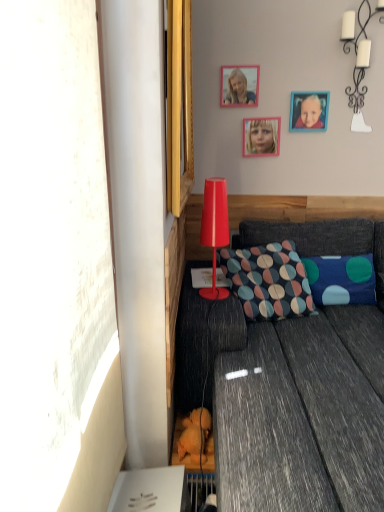
Measure the distance between point (312, 336) and camera.

Point (312, 336) and camera are 6.68 feet apart.

What is the approximate height of textured gray couch at lower right?

textured gray couch at lower right is 32.97 inches in height.

Find the location of a particular element. matte pink frame at upper center is located at coordinates [239, 90].

In order to face blue fabric pillow with colorful circles at lower right, acting as the 2th pillow starting from the left, should I rotate leftwards or rightwards?

It's best to rotate right around 18.941 degrees.

From the picture: In order to face wooden picture frame at upper right, which is the first picture frame from right to left, should I rotate leftwards or rightwards?

To face it directly, rotate right by 15.282 degrees.

Measure the distance between wooden picture frame at upper right, positioned as the second picture frame in left-to-right order, and camera.

wooden picture frame at upper right, positioned as the second picture frame in left-to-right order, and camera are 2.49 meters apart.

What do you see at coordinates (261, 136) in the screenshot? This screenshot has width=384, height=512. I see `wooden picture frame at upper center, which appears as the 1th picture frame when viewed from the left` at bounding box center [261, 136].

This screenshot has height=512, width=384. I want to click on wooden picture frame at upper center, which appears as the 1th picture frame when viewed from the left, so click(x=261, y=136).

You are a GUI agent. You are given a task and a screenshot of the screen. Output one action in this format:
    pyautogui.click(x=<x>, y=<y>)
    Task: Click on the textured gray couch at lower right
    The height and width of the screenshot is (512, 384).
    Given the screenshot: What is the action you would take?
    pyautogui.click(x=288, y=403)

Which object is positioned more to the right, matte pink frame at upper center or wooden picture frame at upper center, which ranks as the 2th picture frame in right-to-left order?

From the viewer's perspective, wooden picture frame at upper center, which ranks as the 2th picture frame in right-to-left order, appears more on the right side.

Which of these two, matte pink frame at upper center or wooden picture frame at upper center, which ranks as the 2th picture frame in right-to-left order, stands shorter?

Standing shorter between the two is wooden picture frame at upper center, which ranks as the 2th picture frame in right-to-left order.

The width and height of the screenshot is (384, 512). There is a wooden picture frame at upper center, which ranks as the 2th picture frame in right-to-left order. In order to click on person above it (from a real-world perspective) in this screenshot , I will do `click(239, 90)`.

Between white ceramic candlestick at upper right, which ranks as the second lamp in front-to-back order, and multicolored fabric pillow at center, the second pillow from the right, which one has larger width?

Wider between the two is multicolored fabric pillow at center, the second pillow from the right.

From the image's perspective, who appears lower, white ceramic candlestick at upper right, which is the first lamp from back to front, or multicolored fabric pillow at center, which is counted as the 1th pillow, starting from the left?

multicolored fabric pillow at center, which is counted as the 1th pillow, starting from the left.

Which object is positioned more to the left, white ceramic candlestick at upper right, arranged as the second lamp when viewed from the left, or multicolored fabric pillow at center, which is counted as the 1th pillow, starting from the left?

From the viewer's perspective, multicolored fabric pillow at center, which is counted as the 1th pillow, starting from the left, appears more on the left side.

Which of these two, matte pink frame at upper center or white ceramic candlestick at upper right, which is the 1th lamp from top to bottom, is smaller?

matte pink frame at upper center.

Does matte pink frame at upper center appear on the right side of white ceramic candlestick at upper right, the 2th lamp from the bottom?

No, matte pink frame at upper center is not to the right of white ceramic candlestick at upper right, the 2th lamp from the bottom.

Does matte pink frame at upper center have a greater width compared to white ceramic candlestick at upper right, which is the 1th lamp from top to bottom?

Incorrect, the width of matte pink frame at upper center does not surpass that of white ceramic candlestick at upper right, which is the 1th lamp from top to bottom.

Considering the points (243, 97) and (368, 59), which point is in front, point (243, 97) or point (368, 59)?

The point (368, 59) is in front.

Considering the positions of objects wooden picture frame at upper right, positioned as the second picture frame in left-to-right order, and wooden picture frame at upper center, which ranks as the 2th picture frame in right-to-left order, in the image provided, who is in front, wooden picture frame at upper right, positioned as the second picture frame in left-to-right order, or wooden picture frame at upper center, which ranks as the 2th picture frame in right-to-left order,?

wooden picture frame at upper right, positioned as the second picture frame in left-to-right order.

From a real-world perspective, does wooden picture frame at upper right, positioned as the second picture frame in left-to-right order, stand above wooden picture frame at upper center, which appears as the 1th picture frame when viewed from the left?

Yes, from a real-world perspective, wooden picture frame at upper right, positioned as the second picture frame in left-to-right order, is above wooden picture frame at upper center, which appears as the 1th picture frame when viewed from the left.

Is wooden picture frame at upper right, which is the first picture frame from right to left, not within wooden picture frame at upper center, which ranks as the 2th picture frame in right-to-left order?

Yes, wooden picture frame at upper right, which is the first picture frame from right to left, is located beyond the bounds of wooden picture frame at upper center, which ranks as the 2th picture frame in right-to-left order.

How different are the orientations of wooden picture frame at upper right, which is the first picture frame from right to left, and wooden picture frame at upper center, which appears as the 1th picture frame when viewed from the left, in degrees?

0.00373 degrees.

Can you tell me how much white ceramic candlestick at upper right, the 2th lamp from the bottom, and textured gray couch at lower right differ in facing direction?

The angle between the facing direction of white ceramic candlestick at upper right, the 2th lamp from the bottom, and the facing direction of textured gray couch at lower right is 0.558 degrees.

The image size is (384, 512). Find the location of `studio couch in front of the white ceramic candlestick at upper right, which is the first lamp in right-to-left order`. studio couch in front of the white ceramic candlestick at upper right, which is the first lamp in right-to-left order is located at coordinates (288, 403).

Which point is more forward, (364, 91) or (178, 400)?

Positioned in front is point (178, 400).

From a real-world perspective, is white ceramic candlestick at upper right, which is the 1th lamp from top to bottom, below textured gray couch at lower right?

No, from a real-world perspective, white ceramic candlestick at upper right, which is the 1th lamp from top to bottom, is not under textured gray couch at lower right.

Is white ceramic candlestick at upper right, which ranks as the second lamp in front-to-back order, facing away from blue fabric pillow with colorful circles at lower right, acting as the 2th pillow starting from the left?

No, white ceramic candlestick at upper right, which ranks as the second lamp in front-to-back order,'s orientation is not away from blue fabric pillow with colorful circles at lower right, acting as the 2th pillow starting from the left.

From the image's perspective, starting from the white ceramic candlestick at upper right, which is the first lamp from back to front, which pillow is the 2nd one below? Please provide its 2D coordinates.

[(341, 279)]

From the picture: Is white ceramic candlestick at upper right, arranged as the second lamp when viewed from the left, bigger or smaller than blue fabric pillow with colorful circles at lower right, which is counted as the 1th pillow, starting from the right?

white ceramic candlestick at upper right, arranged as the second lamp when viewed from the left, is smaller than blue fabric pillow with colorful circles at lower right, which is counted as the 1th pillow, starting from the right.

Is white ceramic candlestick at upper right, arranged as the second lamp when viewed from the left, shorter than blue fabric pillow with colorful circles at lower right, acting as the 2th pillow starting from the left?

Incorrect, the height of white ceramic candlestick at upper right, arranged as the second lamp when viewed from the left, does not fall short of that of blue fabric pillow with colorful circles at lower right, acting as the 2th pillow starting from the left.

Is the position of matte plastic lamp at center, positioned as the second lamp in top-to-bottom order, less distant than that of textured gray couch at lower right?

No.

Which object is positioned more to the right, matte plastic lamp at center, positioned as the 2th lamp in back-to-front order, or textured gray couch at lower right?

textured gray couch at lower right.

Identify the location of studio couch below the matte plastic lamp at center, which ranks as the first lamp in bottom-to-top order (from a real-world perspective). (288, 403).

From the image's perspective, is matte plastic lamp at center, which appears as the second lamp when viewed from the right, above textured gray couch at lower right?

Yes.

Where is `the 2nd picture frame behind the matte pink frame at upper center`? The height and width of the screenshot is (512, 384). the 2nd picture frame behind the matte pink frame at upper center is located at coordinates (261, 136).

At what (x,y) coordinates should I click in order to perform the action: click on pillow that is the 2nd object to the left of the white ceramic candlestick at upper right, which is the first lamp in right-to-left order, starting at the anchor. Please return your answer as a coordinate pair (x, y). The height and width of the screenshot is (512, 384). Looking at the image, I should click on (268, 281).

Looking at the image, which one is located further to white ceramic candlestick at upper right, arranged as the second lamp when viewed from the left, textured gray couch at lower right or transparent glass window at left?

Among the two, transparent glass window at left is located further to white ceramic candlestick at upper right, arranged as the second lamp when viewed from the left.

From the image, which object appears to be nearer to wooden picture frame at upper center, which appears as the 1th picture frame when viewed from the left, matte pink frame at upper center or matte plastic lamp at center, marked as the first lamp in a left-to-right arrangement?

Among the two, matte pink frame at upper center is located nearer to wooden picture frame at upper center, which appears as the 1th picture frame when viewed from the left.

Looking at this image, considering their positions, is matte plastic lamp at center, the 1th lamp positioned from the front, positioned further to matte pink frame at upper center than wooden picture frame at upper right, which is the first picture frame from right to left?

Based on the image, matte plastic lamp at center, the 1th lamp positioned from the front, appears to be further to matte pink frame at upper center.

Considering their positions, is wooden picture frame at upper right, positioned as the second picture frame in left-to-right order, positioned closer to white ceramic candlestick at upper right, which is the 1th lamp from top to bottom, than matte plastic lamp at center, positioned as the 2th lamp in back-to-front order?

Based on the image, wooden picture frame at upper right, positioned as the second picture frame in left-to-right order, appears to be nearer to white ceramic candlestick at upper right, which is the 1th lamp from top to bottom.

Looking at the image, which one is located further to textured gray couch at lower right, blue fabric pillow with colorful circles at lower right, which is counted as the 1th pillow, starting from the right, or wooden picture frame at upper center, which appears as the 1th picture frame when viewed from the left?

wooden picture frame at upper center, which appears as the 1th picture frame when viewed from the left.

Looking at the image, which one is located further to matte plastic lamp at center, which ranks as the first lamp in bottom-to-top order, matte pink frame at upper center or wooden picture frame at upper right, positioned as the second picture frame in left-to-right order?

The object further to matte plastic lamp at center, which ranks as the first lamp in bottom-to-top order, is wooden picture frame at upper right, positioned as the second picture frame in left-to-right order.

Which object lies further to the anchor point wooden picture frame at upper center, which appears as the 1th picture frame when viewed from the left, matte plastic lamp at center, positioned as the second lamp in top-to-bottom order, or transparent glass window at left?

The object further to wooden picture frame at upper center, which appears as the 1th picture frame when viewed from the left, is transparent glass window at left.

Based on their spatial positions, is wooden picture frame at upper center, which ranks as the 2th picture frame in right-to-left order, or transparent glass window at left further from matte pink frame at upper center?

Among the two, transparent glass window at left is located further to matte pink frame at upper center.

Locate an element on the screen. lamp between matte pink frame at upper center and multicolored fabric pillow at center, which is counted as the 1th pillow, starting from the left, from top to bottom is located at coordinates (214, 230).

You are a GUI agent. You are given a task and a screenshot of the screen. Output one action in this format:
    pyautogui.click(x=<x>, y=<y>)
    Task: Click on the picture frame between textured gray couch at lower right and wooden picture frame at upper center, which appears as the 1th picture frame when viewed from the left, from front to back
    The image size is (384, 512).
    Given the screenshot: What is the action you would take?
    pyautogui.click(x=309, y=111)

Locate an element on the screen. studio couch between transparent glass window at left and multicolored fabric pillow at center, the second pillow from the right, in the front-back direction is located at coordinates (288, 403).

At what (x,y) coordinates should I click in order to perform the action: click on picture frame between wooden picture frame at upper right, positioned as the second picture frame in left-to-right order, and multicolored fabric pillow at center, which is counted as the 1th pillow, starting from the left, in the vertical direction. Please return your answer as a coordinate pair (x, y). Looking at the image, I should click on (261, 136).